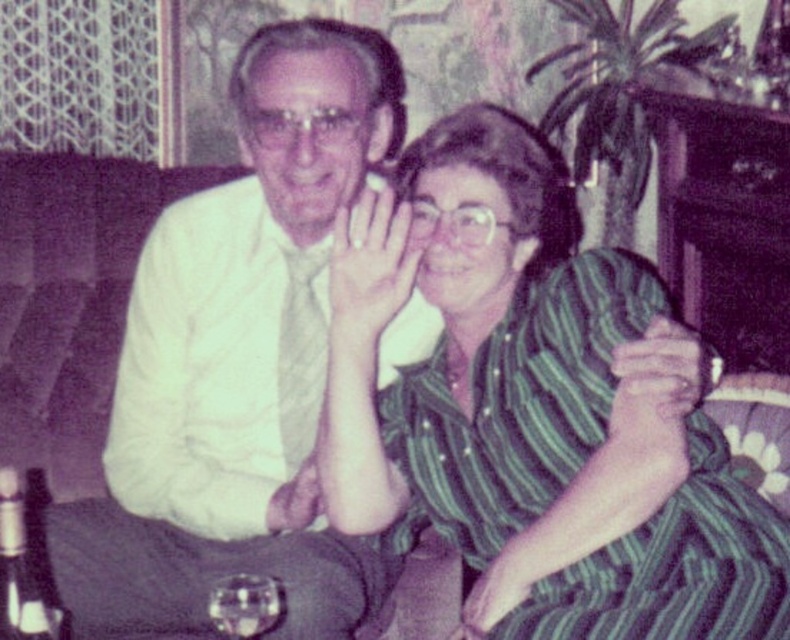
You are at a party and want to grab a drink from the clear glass bottle at lower left. However, there is a point marked at coordinates (21, 572). Is this point on the clear glass bottle at lower left or somewhere else?

The point (21, 572) is on the clear glass bottle at lower left according to the description.

You are organizing a vintage photo exhibit and need to ensure that the white matte shirt at center and the clear glass bottle at lower left are displayed side by side. Given their sizes, which object should be placed on the left to maintain visual balance?

The white matte shirt at center has a larger width than the clear glass bottle at lower left, so placing the wider white matte shirt at center on the left would help maintain visual balance between the two objects.

In the vintage sepia photograph, there are two people sitting together. The man on the left is wearing a light shirt and tie, and the woman on the right has a striped shirt. There is a point marked at coordinates (535, 410). Which object from the scene does this point correspond to?

The point at coordinates (535, 410) is located on the green striped dress at center.